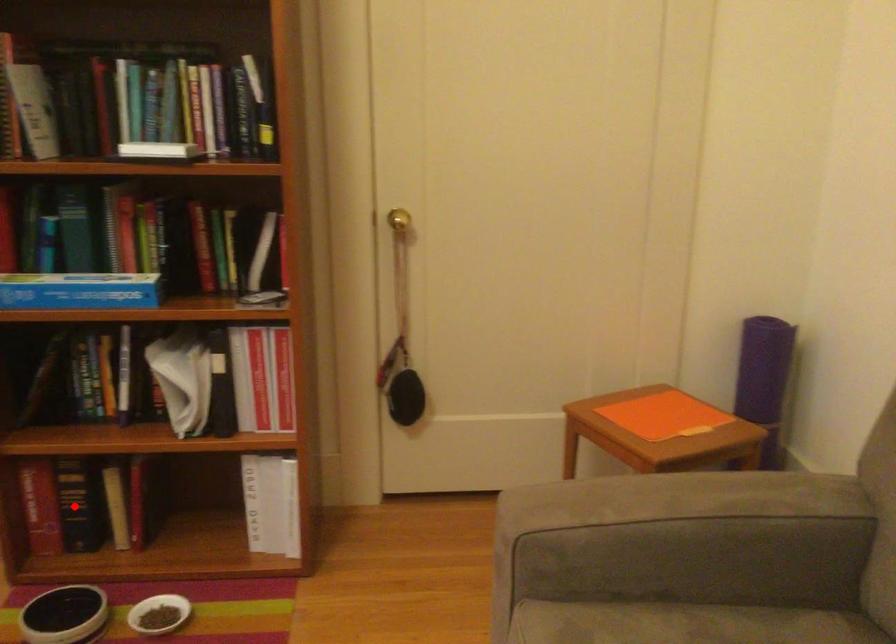
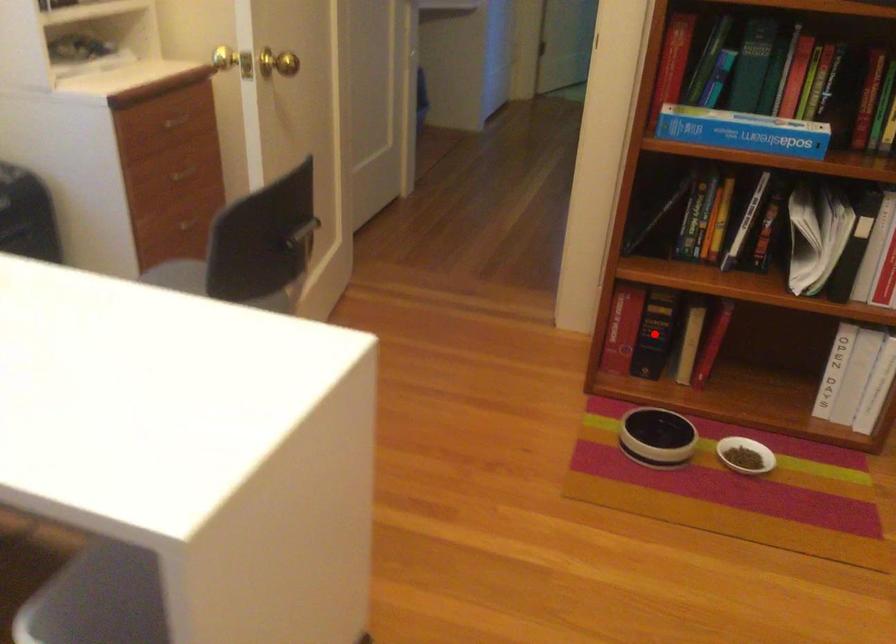
I am providing you with two images of the same scene from different viewpoints. A red point is marked on the first image and another point is marked on the second image. Does the point marked in image1 correspond to the same location as the one in image2?

Yes